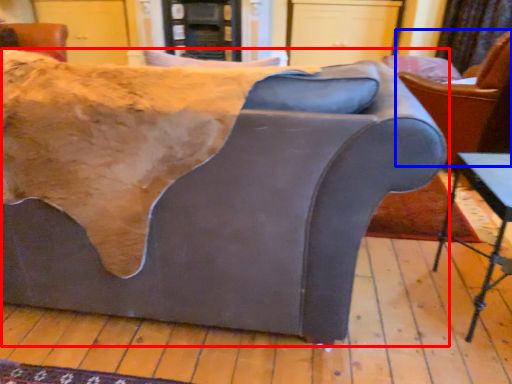
Question: Which point is closer to the camera, studio couch (highlighted by a red box) or chair (highlighted by a blue box)?

Choices:
 (A) studio couch
 (B) chair

Answer: (A)